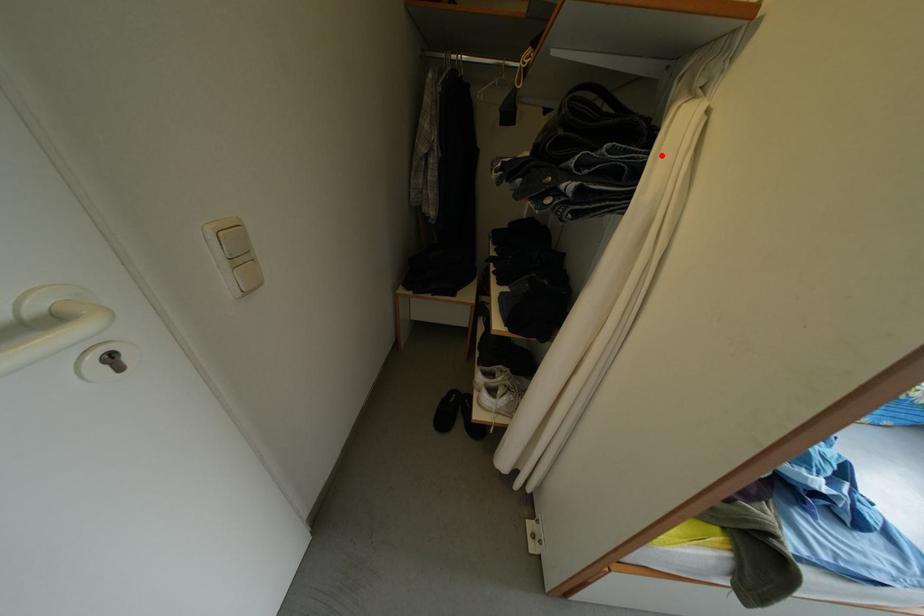
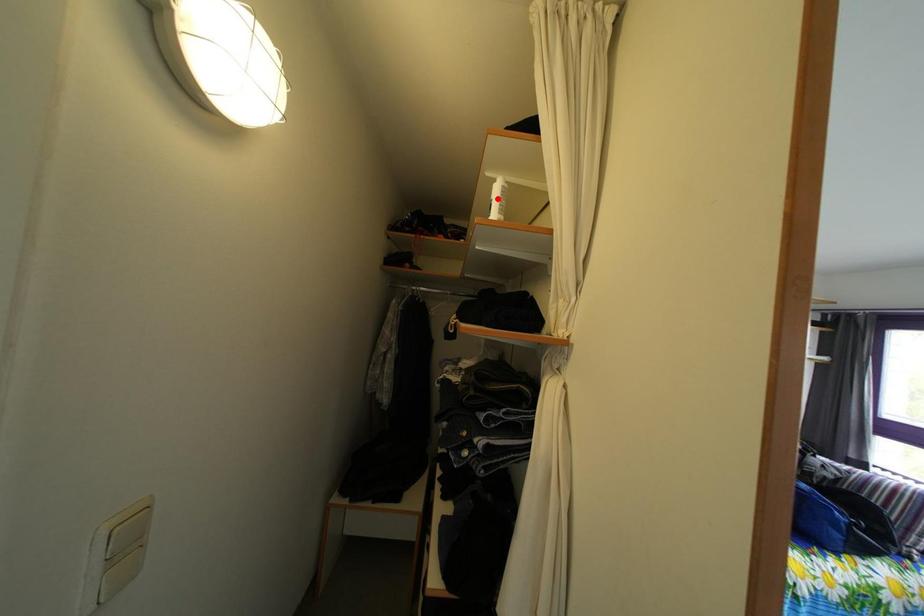
I am providing you with two images of the same scene from different viewpoints. A red point is marked on the first image and another point is marked on the second image. Are the points marked in image1 and image2 representing the same 3D position?

No